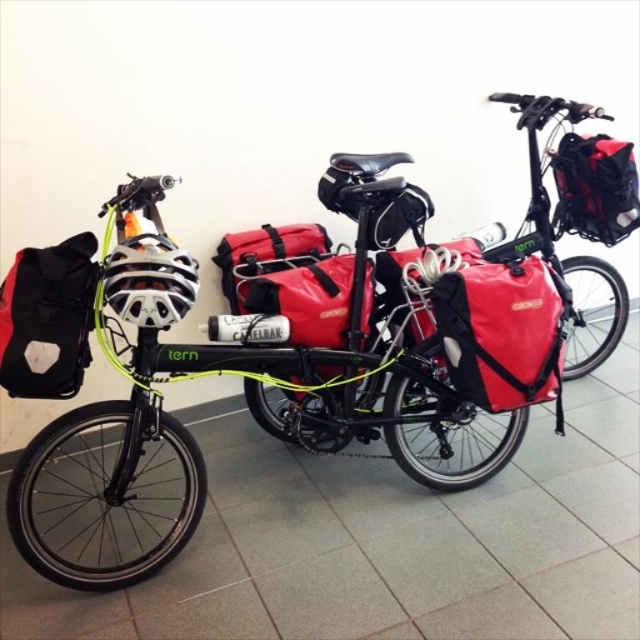
Does point (193, 342) lie behind point (518, 291)?

Yes, point (193, 342) is farther from viewer.

Is matte black bicycle at left to the right of matte black bag at center from the viewer's perspective?

No, matte black bicycle at left is not to the right of matte black bag at center.

Describe the element at coordinates (188, 429) in the screenshot. I see `matte black bicycle at left` at that location.

The image size is (640, 640). Identify the location of matte black bicycle at left. (188, 429).

Does point (65, 323) come closer to viewer compared to point (289, 230)?

Yes, point (65, 323) is in front of point (289, 230).

Is point (19, 282) in front of point (285, 228)?

Yes, it is in front of point (285, 228).

Where is `black fabric backpack at left`? black fabric backpack at left is located at coordinates (48, 317).

Is matte black bicycle at left wider than matte black bag at upper right?

Yes.

Image resolution: width=640 pixels, height=640 pixels. I want to click on matte black bicycle at left, so click(x=188, y=429).

Identify the location of matte black bicycle at left. (188, 429).